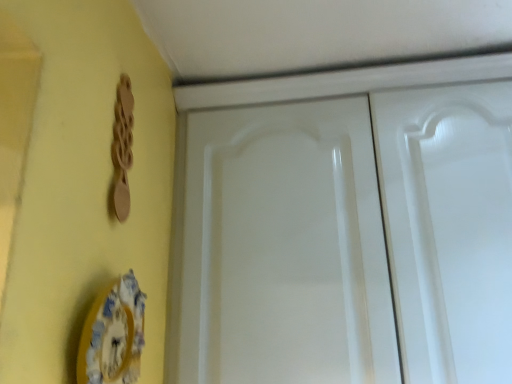
Question: Is white glossy cabinet doors at center surrounding wooden spoon at upper left?

Choices:
 (A) no
 (B) yes

Answer: (A)

Question: Does white glossy cabinet doors at center have a smaller size compared to wooden spoon at upper left?

Choices:
 (A) no
 (B) yes

Answer: (A)

Question: Does white glossy cabinet doors at center have a larger size compared to wooden spoon at upper left?

Choices:
 (A) yes
 (B) no

Answer: (A)

Question: Considering the relative positions of white glossy cabinet doors at center and wooden spoon at upper left in the image provided, is white glossy cabinet doors at center to the right of wooden spoon at upper left from the viewer's perspective?

Choices:
 (A) yes
 (B) no

Answer: (A)

Question: From the image's perspective, is white glossy cabinet doors at center on wooden spoon at upper left?

Choices:
 (A) no
 (B) yes

Answer: (A)

Question: From the image's perspective, relative to wooden spoon at upper left, is white glossy cabinet doors at center above or below?

Choices:
 (A) below
 (B) above

Answer: (A)

Question: From a real-world perspective, is white glossy cabinet doors at center above or below wooden spoon at upper left?

Choices:
 (A) above
 (B) below

Answer: (B)

Question: From their relative heights in the image, would you say white glossy cabinet doors at center is taller or shorter than wooden spoon at upper left?

Choices:
 (A) short
 (B) tall

Answer: (B)

Question: Considering the positions of point (395, 79) and point (120, 220), is point (395, 79) closer or farther from the camera than point (120, 220)?

Choices:
 (A) farther
 (B) closer

Answer: (A)

Question: Visually, is white glossy cabinet doors at center positioned to the left or to the right of porcelain plate at lower left?

Choices:
 (A) right
 (B) left

Answer: (A)

Question: From the image's perspective, is white glossy cabinet doors at center positioned above or below porcelain plate at lower left?

Choices:
 (A) above
 (B) below

Answer: (A)

Question: Is white glossy cabinet doors at center in front of or behind porcelain plate at lower left in the image?

Choices:
 (A) behind
 (B) front

Answer: (A)

Question: Is white glossy cabinet doors at center bigger or smaller than porcelain plate at lower left?

Choices:
 (A) big
 (B) small

Answer: (A)

Question: Relative to white glossy cabinet doors at center, is wooden spoon at upper left in front or behind?

Choices:
 (A) front
 (B) behind

Answer: (A)

Question: Is wooden spoon at upper left to the left or to the right of white glossy cabinet doors at center in the image?

Choices:
 (A) left
 (B) right

Answer: (A)